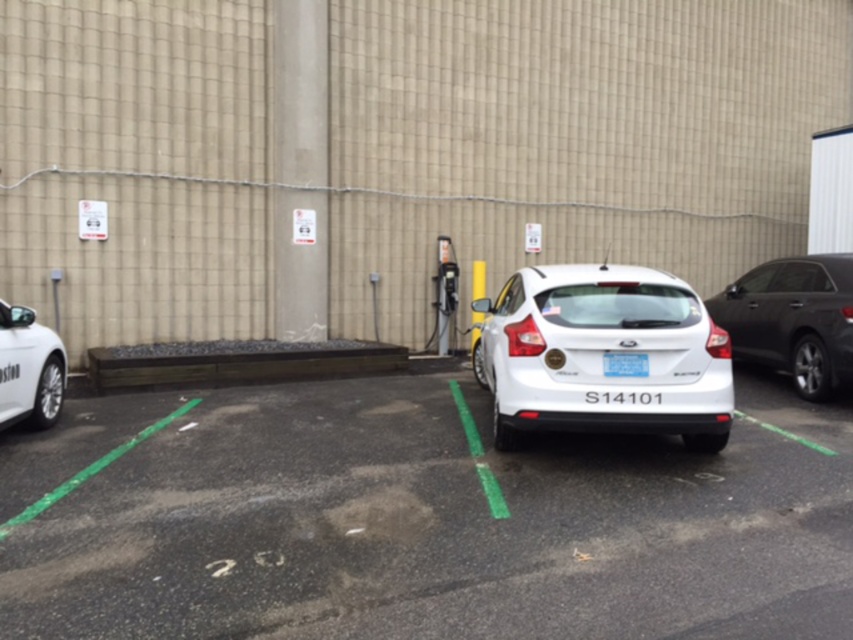
Question: Is white matte hatchback at center wider than blue matte license plate at center?

Choices:
 (A) no
 (B) yes

Answer: (B)

Question: Is white matte hatchback at center behind white matte car at left?

Choices:
 (A) no
 (B) yes

Answer: (A)

Question: Which point is closer to the camera taking this photo?

Choices:
 (A) (45, 513)
 (B) (608, 353)

Answer: (A)

Question: Among these points, which one is nearest to the camera?

Choices:
 (A) (751, 456)
 (B) (640, 323)
 (C) (628, 376)

Answer: (C)

Question: Which point appears farthest from the camera in this image?

Choices:
 (A) (613, 534)
 (B) (39, 369)
 (C) (804, 288)

Answer: (C)

Question: Can you confirm if white matte car at left is positioned below blue matte license plate at center?

Choices:
 (A) no
 (B) yes

Answer: (B)